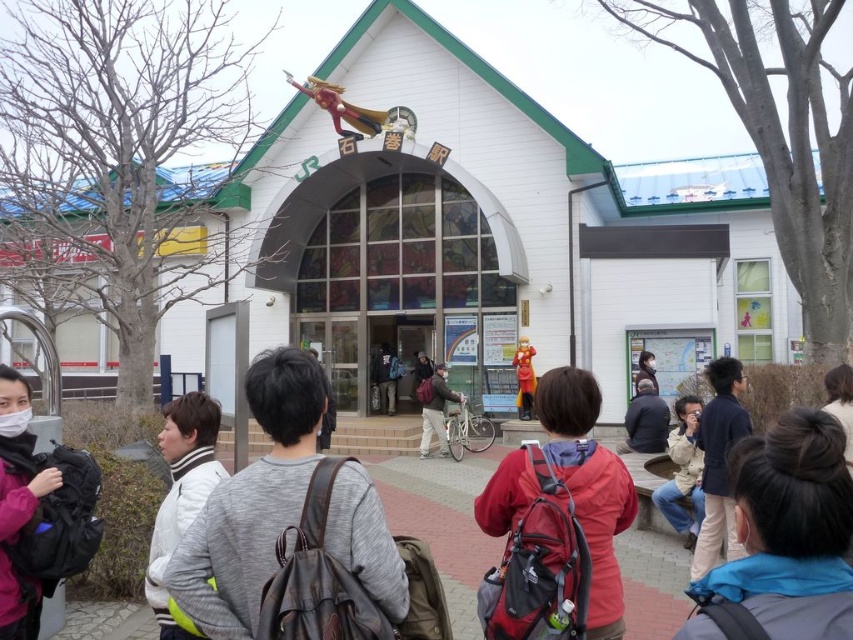
Which is in front, point (236, 541) or point (437, 394)?

Point (236, 541) is more forward.

Consider the image. Can you confirm if gray fabric backpacks at center is bigger than matte gray backpack at center?

No, gray fabric backpacks at center is not bigger than matte gray backpack at center.

Is point (276, 406) closer to viewer compared to point (430, 429)?

Yes, point (276, 406) is in front of point (430, 429).

The height and width of the screenshot is (640, 853). I want to click on gray fabric backpacks at center, so click(281, 515).

Is point (296, 477) positioned behind point (445, 376)?

No, (296, 477) is in front of (445, 376).

Is gray fabric backpack at center smaller than matte gray backpack at center?

Correct, gray fabric backpack at center occupies less space than matte gray backpack at center.

What are the coordinates of `gray fabric backpack at center` in the screenshot? It's located at (247, 512).

Does point (532, 198) come closer to viewer compared to point (701, 515)?

No, (532, 198) is behind (701, 515).

Who is positioned more to the right, white matte building at center or light brown fabric jacket at lower right?

light brown fabric jacket at lower right is more to the right.

Is point (793, 288) farther from viewer compared to point (688, 401)?

That is True.

What are the coordinates of `white matte building at center` in the screenshot? It's located at (498, 228).